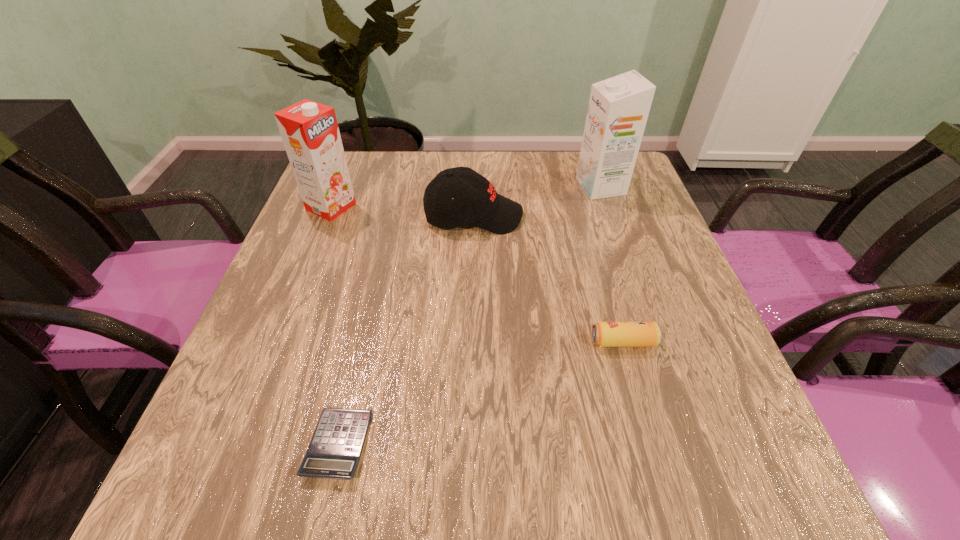
The width and height of the screenshot is (960, 540). What are the coordinates of `the right carton` in the screenshot? It's located at (618, 109).

The image size is (960, 540). Find the location of `the left carton`. the left carton is located at coordinates (309, 130).

Where is `the third object from left to right`? The image size is (960, 540). the third object from left to right is located at coordinates point(475,201).

Identify the location of the third tallest object. Image resolution: width=960 pixels, height=540 pixels. (475, 201).

Where is `the fourth tallest object`? The image size is (960, 540). the fourth tallest object is located at coordinates (604, 334).

The width and height of the screenshot is (960, 540). What are the coordinates of `the second nearest object` in the screenshot? It's located at (604, 334).

What are the coordinates of `the fourth object from right to left` in the screenshot? It's located at (334, 452).

Identify the location of the shortest object. The width and height of the screenshot is (960, 540). (334, 452).

You are a GUI agent. You are given a task and a screenshot of the screen. Output one action in this format:
    pyautogui.click(x=<x>, y=<y>)
    Task: Click on the vacant area situated on the front of the right carton
    The width and height of the screenshot is (960, 540).
    Given the screenshot: What is the action you would take?
    pyautogui.click(x=646, y=319)

Locate an element on the screen. This screenshot has width=960, height=540. free region located on the back of the left carton is located at coordinates (352, 153).